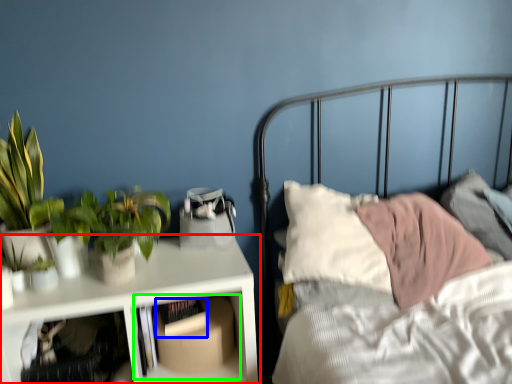
Question: Estimate the real-world distances between objects in this image. Which object is farther from table (highlighted by a red box), book (highlighted by a blue box) or shelf (highlighted by a green box)?

Choices:
 (A) book
 (B) shelf

Answer: (A)